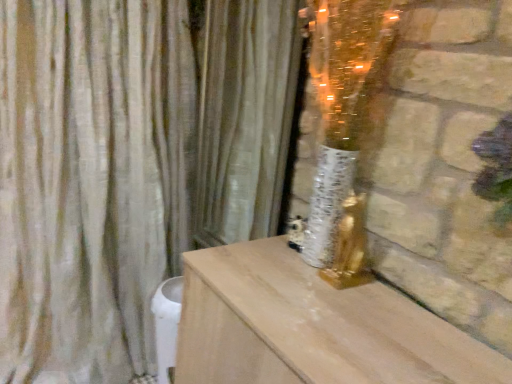
What do you see at coordinates (244, 116) in the screenshot? I see `silky beige curtain at center, placed as the second curtain when sorted from left to right` at bounding box center [244, 116].

From the picture: What is the approximate width of silky beige curtain at center, placed as the second curtain when sorted from left to right?

It is 2.16 inches.

Identify the location of silky beige curtain at center, placed as the second curtain when sorted from left to right. (244, 116).

What is the approximate height of beige fabric curtain at left, which appears as the second curtain when viewed from the right?

It is 1.50 meters.

The height and width of the screenshot is (384, 512). Describe the element at coordinates (129, 166) in the screenshot. I see `beige fabric curtain at left, which appears as the second curtain when viewed from the right` at that location.

How much space does beige fabric curtain at left, which appears as the second curtain when viewed from the right, occupy horizontally?

It is 17.58 inches.

I want to click on beige fabric curtain at left, the first curtain viewed from the left, so click(x=129, y=166).

Identify the location of silky beige curtain at center, placed as the second curtain when sorted from left to right. This screenshot has height=384, width=512. (244, 116).

Considering the positions of objects beige fabric curtain at left, the first curtain viewed from the left, and silky beige curtain at center, placed as the second curtain when sorted from left to right, in the image provided, who is more to the left, beige fabric curtain at left, the first curtain viewed from the left, or silky beige curtain at center, placed as the second curtain when sorted from left to right,?

beige fabric curtain at left, the first curtain viewed from the left.

Who is more distant, beige fabric curtain at left, the first curtain viewed from the left, or silky beige curtain at center, which is counted as the 1th curtain, starting from the right?

silky beige curtain at center, which is counted as the 1th curtain, starting from the right, is further away from the camera.

Consider the image. Which is farther, (234, 182) or (220, 220)?

The point (220, 220) is farther.

From the image's perspective, is beige fabric curtain at left, the first curtain viewed from the left, beneath silky beige curtain at center, placed as the second curtain when sorted from left to right?

Yes, from the image's perspective, beige fabric curtain at left, the first curtain viewed from the left, is beneath silky beige curtain at center, placed as the second curtain when sorted from left to right.

In the scene shown: From a real-world perspective, which is physically above, beige fabric curtain at left, which appears as the second curtain when viewed from the right, or silky beige curtain at center, placed as the second curtain when sorted from left to right?

From a 3D spatial view, silky beige curtain at center, placed as the second curtain when sorted from left to right, is above.

Considering the relative sizes of beige fabric curtain at left, which appears as the second curtain when viewed from the right, and silky beige curtain at center, which is counted as the 1th curtain, starting from the right, in the image provided, is beige fabric curtain at left, which appears as the second curtain when viewed from the right, thinner than silky beige curtain at center, which is counted as the 1th curtain, starting from the right,?

Incorrect, the width of beige fabric curtain at left, which appears as the second curtain when viewed from the right, is not less than that of silky beige curtain at center, which is counted as the 1th curtain, starting from the right.

Does beige fabric curtain at left, which appears as the second curtain when viewed from the right, have a greater height compared to silky beige curtain at center, placed as the second curtain when sorted from left to right?

Yes, beige fabric curtain at left, which appears as the second curtain when viewed from the right, is taller than silky beige curtain at center, placed as the second curtain when sorted from left to right.

Which of these two, beige fabric curtain at left, which appears as the second curtain when viewed from the right, or silky beige curtain at center, which is counted as the 1th curtain, starting from the right, is bigger?

Bigger between the two is beige fabric curtain at left, which appears as the second curtain when viewed from the right.

Is silky beige curtain at center, placed as the second curtain when sorted from left to right, completely or partially inside beige fabric curtain at left, which appears as the second curtain when viewed from the right?

No.

Are beige fabric curtain at left, which appears as the second curtain when viewed from the right, and silky beige curtain at center, which is counted as the 1th curtain, starting from the right, beside each other?

No, beige fabric curtain at left, which appears as the second curtain when viewed from the right, is not next to silky beige curtain at center, which is counted as the 1th curtain, starting from the right.

Is silky beige curtain at center, which is counted as the 1th curtain, starting from the right, at the back of beige fabric curtain at left, which appears as the second curtain when viewed from the right?

That's not correct — beige fabric curtain at left, which appears as the second curtain when viewed from the right, is not looking away from silky beige curtain at center, which is counted as the 1th curtain, starting from the right.

Based on the photo, how many degrees apart are the facing directions of beige fabric curtain at left, the first curtain viewed from the left, and silky beige curtain at center, placed as the second curtain when sorted from left to right?

beige fabric curtain at left, the first curtain viewed from the left, and silky beige curtain at center, placed as the second curtain when sorted from left to right, are facing 88.4 degrees away from each other.

Measure the distance between beige fabric curtain at left, the first curtain viewed from the left, and silky beige curtain at center, placed as the second curtain when sorted from left to right.

beige fabric curtain at left, the first curtain viewed from the left, and silky beige curtain at center, placed as the second curtain when sorted from left to right, are 7.16 inches apart from each other.

Locate an element on the screen. This screenshot has height=384, width=512. curtain that is on the left side of silky beige curtain at center, which is counted as the 1th curtain, starting from the right is located at coordinates (129, 166).

Which object is positioned more to the left, silky beige curtain at center, placed as the second curtain when sorted from left to right, or beige fabric curtain at left, the first curtain viewed from the left?

From the viewer's perspective, beige fabric curtain at left, the first curtain viewed from the left, appears more on the left side.

Is the depth of silky beige curtain at center, placed as the second curtain when sorted from left to right, less than that of beige fabric curtain at left, the first curtain viewed from the left?

No, silky beige curtain at center, placed as the second curtain when sorted from left to right, is behind beige fabric curtain at left, the first curtain viewed from the left.

Is point (259, 192) positioned in front of point (32, 68)?

No, (259, 192) is behind (32, 68).

From the image's perspective, is silky beige curtain at center, which is counted as the 1th curtain, starting from the right, positioned above or below beige fabric curtain at left, the first curtain viewed from the left?

Clearly, from the image's perspective, silky beige curtain at center, which is counted as the 1th curtain, starting from the right, is above beige fabric curtain at left, the first curtain viewed from the left.

From a real-world perspective, which is physically below, silky beige curtain at center, placed as the second curtain when sorted from left to right, or beige fabric curtain at left, which appears as the second curtain when viewed from the right?

beige fabric curtain at left, which appears as the second curtain when viewed from the right, from a real-world perspective.

Considering the sizes of objects silky beige curtain at center, placed as the second curtain when sorted from left to right, and beige fabric curtain at left, the first curtain viewed from the left, in the image provided, who is thinner, silky beige curtain at center, placed as the second curtain when sorted from left to right, or beige fabric curtain at left, the first curtain viewed from the left,?

silky beige curtain at center, placed as the second curtain when sorted from left to right.

Considering the relative sizes of silky beige curtain at center, which is counted as the 1th curtain, starting from the right, and beige fabric curtain at left, which appears as the second curtain when viewed from the right, in the image provided, is silky beige curtain at center, which is counted as the 1th curtain, starting from the right, shorter than beige fabric curtain at left, which appears as the second curtain when viewed from the right,?

Yes, silky beige curtain at center, which is counted as the 1th curtain, starting from the right, is shorter than beige fabric curtain at left, which appears as the second curtain when viewed from the right.

Based on the photo, based on their sizes in the image, would you say silky beige curtain at center, placed as the second curtain when sorted from left to right, is bigger or smaller than beige fabric curtain at left, which appears as the second curtain when viewed from the right?

Clearly, silky beige curtain at center, placed as the second curtain when sorted from left to right, is smaller in size than beige fabric curtain at left, which appears as the second curtain when viewed from the right.

Can beige fabric curtain at left, the first curtain viewed from the left, be found inside silky beige curtain at center, which is counted as the 1th curtain, starting from the right?

No, beige fabric curtain at left, the first curtain viewed from the left, is not inside silky beige curtain at center, which is counted as the 1th curtain, starting from the right.

Is silky beige curtain at center, placed as the second curtain when sorted from left to right, far away from beige fabric curtain at left, which appears as the second curtain when viewed from the right?

No, there isn't a large distance between silky beige curtain at center, placed as the second curtain when sorted from left to right, and beige fabric curtain at left, which appears as the second curtain when viewed from the right.

Is silky beige curtain at center, which is counted as the 1th curtain, starting from the right, positioned with its back to beige fabric curtain at left, the first curtain viewed from the left?

That's not correct — silky beige curtain at center, which is counted as the 1th curtain, starting from the right, is not looking away from beige fabric curtain at left, the first curtain viewed from the left.

How different are the orientations of silky beige curtain at center, placed as the second curtain when sorted from left to right, and beige fabric curtain at left, the first curtain viewed from the left, in degrees?

The angular difference between silky beige curtain at center, placed as the second curtain when sorted from left to right, and beige fabric curtain at left, the first curtain viewed from the left, is 88.4 degrees.

Find the location of `curtain above the beige fabric curtain at left, which appears as the second curtain when viewed from the right (from a real-world perspective)`. curtain above the beige fabric curtain at left, which appears as the second curtain when viewed from the right (from a real-world perspective) is located at coordinates (244, 116).

Find the location of `curtain to the left of silky beige curtain at center, placed as the second curtain when sorted from left to right`. curtain to the left of silky beige curtain at center, placed as the second curtain when sorted from left to right is located at coordinates (129, 166).

Locate an element on the screen. This screenshot has height=384, width=512. curtain above the beige fabric curtain at left, the first curtain viewed from the left (from a real-world perspective) is located at coordinates (244, 116).